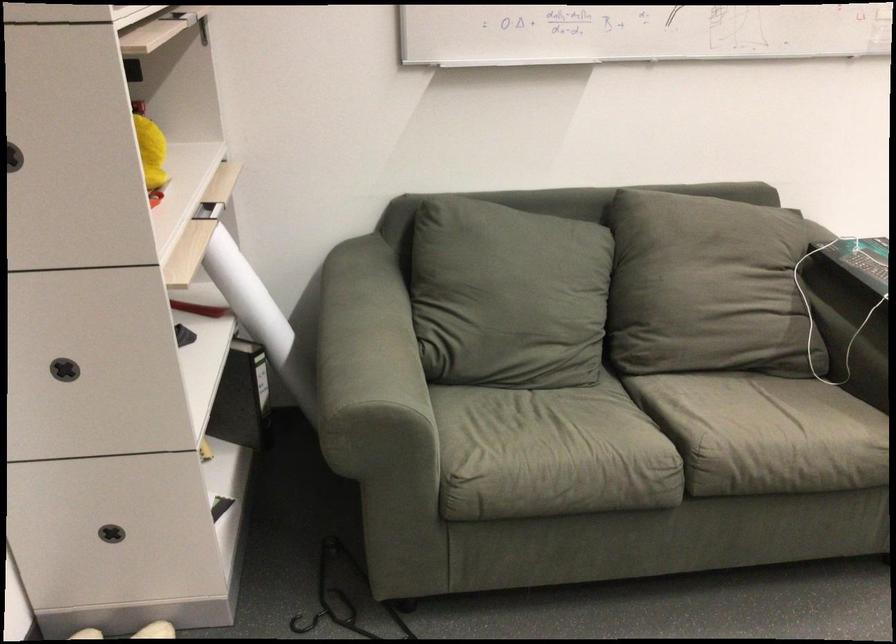
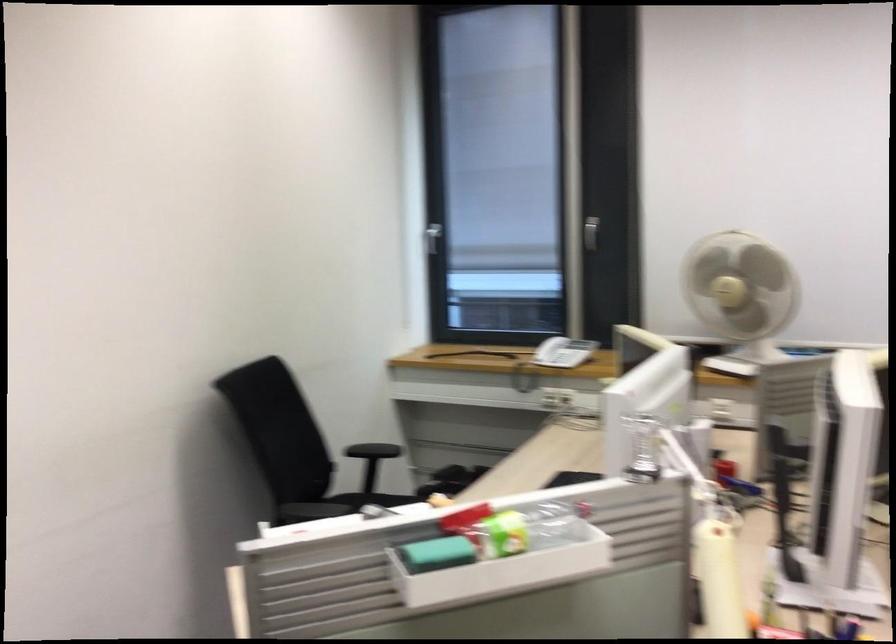
Question: The first image is from the beginning of the video and the second image is from the end. How did the camera likely rotate when shooting the video?

Choices:
 (A) Left
 (B) Right
 (C) Up
 (D) Down

Answer: (B)